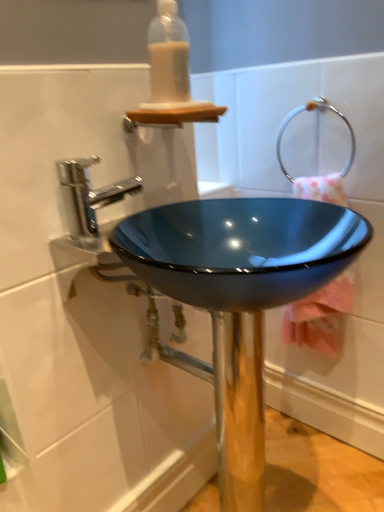
Find the location of a particular element. silver metallic towel ring at upper right is located at coordinates (319, 111).

Describe the element at coordinates (168, 55) in the screenshot. The width and height of the screenshot is (384, 512). I see `translucent plastic bottle at upper center` at that location.

At what (x,y) coordinates should I click in order to perform the action: click on polished chrome faucet at upper left. Please return your answer as a coordinate pair (x, y). This screenshot has width=384, height=512. Looking at the image, I should click on (88, 195).

Find the location of `glossy blue bowl at center`. glossy blue bowl at center is located at coordinates (234, 300).

The image size is (384, 512). What do you see at coordinates (234, 300) in the screenshot?
I see `glossy blue bowl at center` at bounding box center [234, 300].

Where is `silver metallic towel ring at upper right`? silver metallic towel ring at upper right is located at coordinates coord(319,111).

Is polished chrome faucet at upper left at the back of translucent plastic bottle at upper center?

No, polished chrome faucet at upper left is not at the back of translucent plastic bottle at upper center.

From the picture: Are translucent plastic bottle at upper center and polished chrome faucet at upper left located far from each other?

No, translucent plastic bottle at upper center is not far from polished chrome faucet at upper left.

What's the angular difference between translucent plastic bottle at upper center and polished chrome faucet at upper left's facing directions?

0.652 degrees.

Can you see polished chrome faucet at upper left touching silver metallic towel ring at upper right?

No, polished chrome faucet at upper left is not making contact with silver metallic towel ring at upper right.

Can you confirm if polished chrome faucet at upper left is bigger than silver metallic towel ring at upper right?

Incorrect, polished chrome faucet at upper left is not larger than silver metallic towel ring at upper right.

From the picture: Does polished chrome faucet at upper left appear on the right side of silver metallic towel ring at upper right?

No.

From the image's perspective, is pink fabric towel at center right above silver metallic towel ring at upper right?

No, from the image's perspective, pink fabric towel at center right is not above silver metallic towel ring at upper right.

Measure the distance between pink fabric towel at center right and silver metallic towel ring at upper right.

They are 10.86 inches apart.

Considering the sizes of objects pink fabric towel at center right and silver metallic towel ring at upper right in the image provided, who is thinner, pink fabric towel at center right or silver metallic towel ring at upper right?

Thinner between the two is silver metallic towel ring at upper right.

Between pink fabric towel at center right and silver metallic towel ring at upper right, which one appears on the left side from the viewer's perspective?

Positioned to the left is silver metallic towel ring at upper right.

From a real-world perspective, is translucent plastic bottle at upper center positioned above or below pink fabric towel at center right?

translucent plastic bottle at upper center is above pink fabric towel at center right.

Who is smaller, translucent plastic bottle at upper center or pink fabric towel at center right?

translucent plastic bottle at upper center.

Which is in front, point (159, 62) or point (334, 179)?

The point (159, 62) is closer.

Considering the sizes of objects translucent plastic bottle at upper center and pink fabric towel at center right in the image provided, who is wider, translucent plastic bottle at upper center or pink fabric towel at center right?

pink fabric towel at center right is wider.

At what (x,y) coordinates should I click in order to perform the action: click on tap positioned vertically above the glossy blue bowl at center (from a real-world perspective). Please return your answer as a coordinate pair (x, y). Image resolution: width=384 pixels, height=512 pixels. Looking at the image, I should click on (88, 195).

What's the angular difference between polished chrome faucet at upper left and glossy blue bowl at center's facing directions?

The angular difference between polished chrome faucet at upper left and glossy blue bowl at center is 0.118 degrees.

Is polished chrome faucet at upper left oriented away from glossy blue bowl at center?

No, polished chrome faucet at upper left is not facing away from glossy blue bowl at center.

Considering the positions of objects polished chrome faucet at upper left and glossy blue bowl at center in the image provided, who is in front, polished chrome faucet at upper left or glossy blue bowl at center?

Positioned in front is glossy blue bowl at center.

Can you tell me how much polished chrome faucet at upper left and translucent plastic bottle at upper center differ in facing direction?

The angular difference between polished chrome faucet at upper left and translucent plastic bottle at upper center is 0.652 degrees.

Between polished chrome faucet at upper left and translucent plastic bottle at upper center, which one is positioned in front?

polished chrome faucet at upper left is closer to the camera.

At what (x,y) coordinates should I click in order to perform the action: click on tap lying in front of the translucent plastic bottle at upper center. Please return your answer as a coordinate pair (x, y). Image resolution: width=384 pixels, height=512 pixels. Looking at the image, I should click on (88, 195).

From the picture: Considering the relative sizes of translucent plastic bottle at upper center and silver metallic towel ring at upper right in the image provided, is translucent plastic bottle at upper center smaller than silver metallic towel ring at upper right?

Yes, translucent plastic bottle at upper center is smaller than silver metallic towel ring at upper right.

In the scene shown: Is translucent plastic bottle at upper center inside or outside of silver metallic towel ring at upper right?

translucent plastic bottle at upper center cannot be found inside silver metallic towel ring at upper right.

Is translucent plastic bottle at upper center thinner than silver metallic towel ring at upper right?

No, translucent plastic bottle at upper center is not thinner than silver metallic towel ring at upper right.

Find the location of `bottle that appears above the polished chrome faucet at upper left (from the image's perspective)`. bottle that appears above the polished chrome faucet at upper left (from the image's perspective) is located at coordinates (168, 55).

Find the location of a particular element. This screenshot has height=512, width=384. shower that appears above the polished chrome faucet at upper left (from a real-world perspective) is located at coordinates (319, 111).

Consider the image. Considering their positions, is translucent plastic bottle at upper center positioned closer to silver metallic towel ring at upper right than polished chrome faucet at upper left?

The object closer to silver metallic towel ring at upper right is translucent plastic bottle at upper center.

Estimate the real-world distances between objects in this image. Which object is further from silver metallic towel ring at upper right, glossy blue bowl at center or translucent plastic bottle at upper center?

The object further to silver metallic towel ring at upper right is translucent plastic bottle at upper center.

In the scene shown: Which object lies further to the anchor point polished chrome faucet at upper left, pink fabric towel at center right or glossy blue bowl at center?

pink fabric towel at center right.

Which object lies nearer to the anchor point polished chrome faucet at upper left, translucent plastic bottle at upper center or silver metallic towel ring at upper right?

translucent plastic bottle at upper center is positioned closer to the anchor polished chrome faucet at upper left.

Considering their positions, is silver metallic towel ring at upper right positioned further to translucent plastic bottle at upper center than glossy blue bowl at center?

silver metallic towel ring at upper right lies further to translucent plastic bottle at upper center than the other object.

Which object lies nearer to the anchor point pink fabric towel at center right, translucent plastic bottle at upper center or glossy blue bowl at center?

Among the two, glossy blue bowl at center is located nearer to pink fabric towel at center right.

Based on the photo, when comparing their distances from silver metallic towel ring at upper right, does translucent plastic bottle at upper center or glossy blue bowl at center seem closer?

glossy blue bowl at center is closer to silver metallic towel ring at upper right.

Which object lies further to the anchor point silver metallic towel ring at upper right, glossy blue bowl at center or polished chrome faucet at upper left?

polished chrome faucet at upper left.

Locate an element on the screen. shower between translucent plastic bottle at upper center and glossy blue bowl at center from top to bottom is located at coordinates (319, 111).

Identify the location of sink between polished chrome faucet at upper left and pink fabric towel at center right. The width and height of the screenshot is (384, 512). (234, 300).

The image size is (384, 512). Identify the location of tap between silver metallic towel ring at upper right and glossy blue bowl at center vertically. (88, 195).

I want to click on tap between translucent plastic bottle at upper center and glossy blue bowl at center in the vertical direction, so click(88, 195).